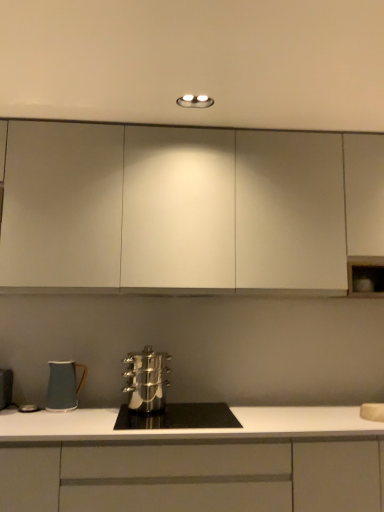
You are a GUI agent. You are given a task and a screenshot of the screen. Output one action in this format:
    pyautogui.click(x=<x>, y=<y>)
    Task: Click on the free point to the right of matte ceramic mug at lower left, marked as the first kitchen appliance in a left-to-right arrangement
    
    Given the screenshot: What is the action you would take?
    pyautogui.click(x=98, y=412)